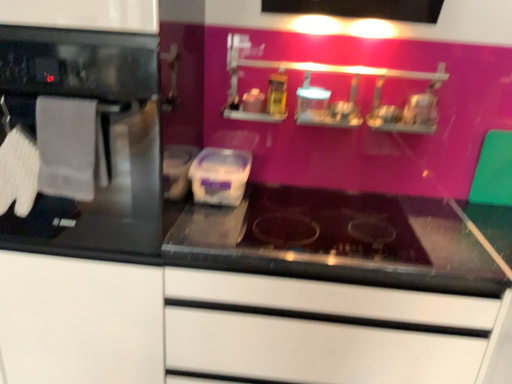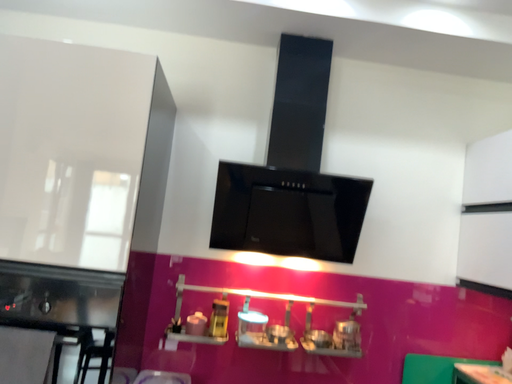
Question: Which way did the camera rotate in the video?

Choices:
 (A) rotated downward
 (B) rotated upward

Answer: (B)